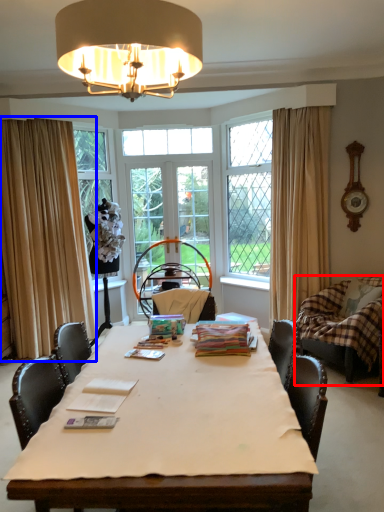
Question: Which object is further to the camera taking this photo, swivel chair (highlighted by a red box) or curtain (highlighted by a blue box)?

Choices:
 (A) swivel chair
 (B) curtain

Answer: (B)